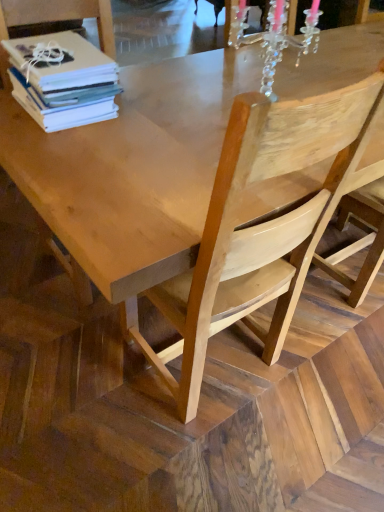
Question: Looking at the image, does natural wood chair at center, the second chair in the right-to-left sequence, seem bigger or smaller compared to natural wood chair at center?

Choices:
 (A) big
 (B) small

Answer: (B)

Question: Is natural wood chair at center, the second chair in the right-to-left sequence, in front of or behind natural wood chair at center in the image?

Choices:
 (A) behind
 (B) front

Answer: (B)

Question: Which of these objects is positioned farthest from the clear crystal chandelier at upper center?

Choices:
 (A) natural wood chair at center, positioned as the 3th chair in right-to-left order
 (B) natural wood chair at right, which ranks as the 3th chair in left-to-right order
 (C) natural wood chair at center
 (D) natural wood table at center
 (E) natural wood chair at center, the second chair in the right-to-left sequence

Answer: (C)

Question: Which object is the farthest from the natural wood chair at center, the second chair when ordered from left to right?

Choices:
 (A) natural wood chair at right, which is the 1th chair from right to left
 (B) white paper stack at upper left
 (C) clear crystal chandelier at upper center
 (D) natural wood chair at center, positioned as the 3th chair in right-to-left order
 (E) natural wood table at center

Answer: (D)